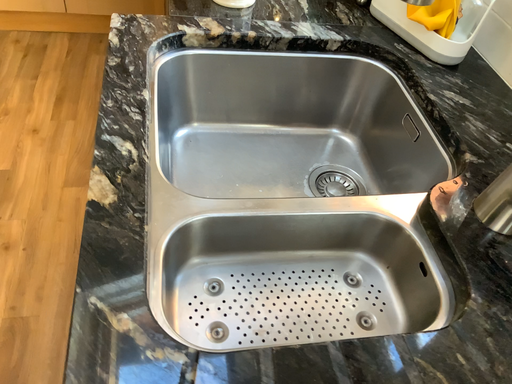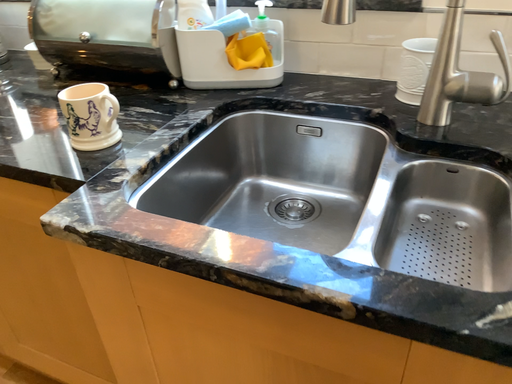
Question: How did the camera likely rotate when shooting the video?

Choices:
 (A) rotated right
 (B) rotated left

Answer: (A)